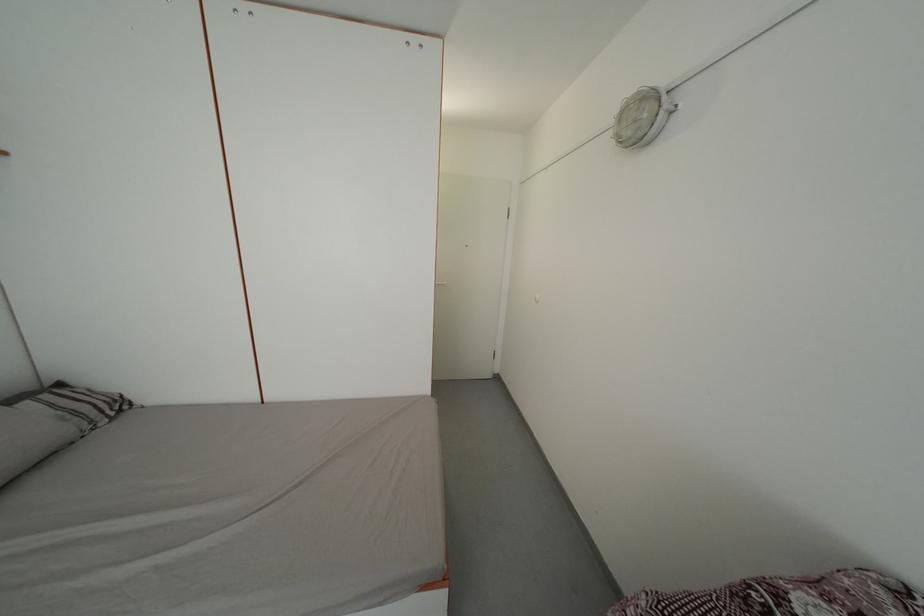
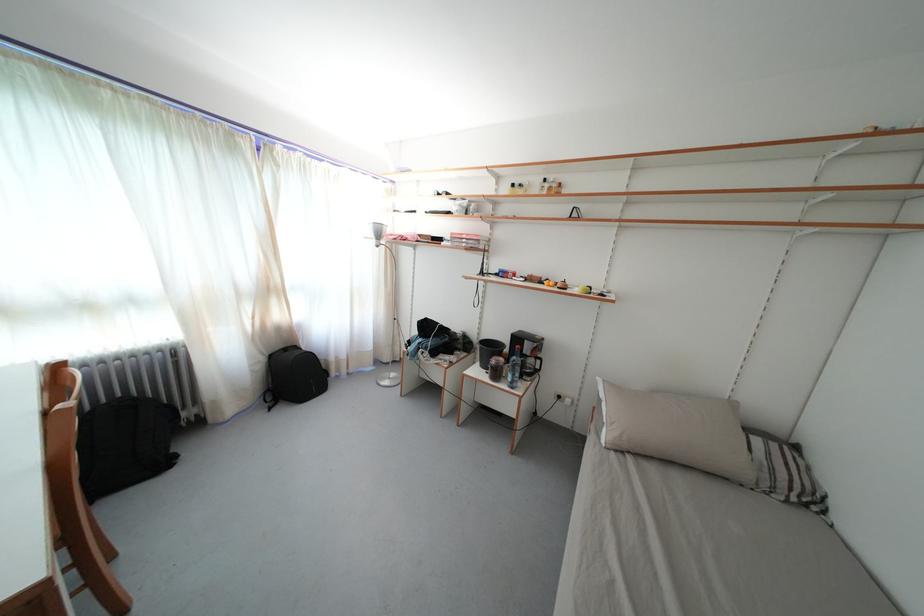
Question: I am providing you with two images of the same scene from different viewpoints. Please identify which objects are invisible in image2.

Choices:
 (A) black backpack
 (B) floor lamp head
 (C) glass jar
 (D) none of these

Answer: (D)